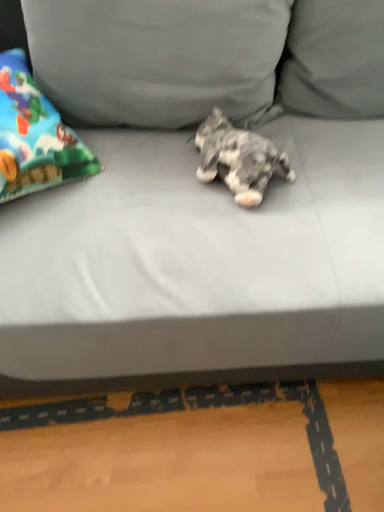
Question: Can you confirm if gray fabric pillow at upper center is wider than gray fabric couch at center?

Choices:
 (A) no
 (B) yes

Answer: (A)

Question: Is gray fabric pillow at upper center facing away from gray fabric couch at center?

Choices:
 (A) yes
 (B) no

Answer: (A)

Question: From the image's perspective, is gray fabric pillow at upper center beneath gray fabric couch at center?

Choices:
 (A) no
 (B) yes

Answer: (A)

Question: Is gray fabric pillow at upper center at the left side of gray fabric couch at center?

Choices:
 (A) no
 (B) yes

Answer: (B)

Question: Is gray fabric pillow at upper center next to gray fabric couch at center?

Choices:
 (A) no
 (B) yes

Answer: (A)

Question: Does point (210, 5) appear closer or farther from the camera than point (218, 138)?

Choices:
 (A) farther
 (B) closer

Answer: (B)

Question: Considering the positions of gray fabric pillow at upper center and fluffy gray dog at center in the image, is gray fabric pillow at upper center wider or thinner than fluffy gray dog at center?

Choices:
 (A) thin
 (B) wide

Answer: (B)

Question: Is gray fabric pillow at upper center taller or shorter than fluffy gray dog at center?

Choices:
 (A) short
 (B) tall

Answer: (B)

Question: Would you say gray fabric pillow at upper center is to the left or to the right of fluffy gray dog at center in the picture?

Choices:
 (A) right
 (B) left

Answer: (B)

Question: Which is correct: gray fabric couch at center is inside fluffy gray dog at center, or outside of it?

Choices:
 (A) outside
 (B) inside

Answer: (A)

Question: In terms of width, does gray fabric couch at center look wider or thinner when compared to fluffy gray dog at center?

Choices:
 (A) thin
 (B) wide

Answer: (B)

Question: From their relative heights in the image, would you say gray fabric couch at center is taller or shorter than fluffy gray dog at center?

Choices:
 (A) short
 (B) tall

Answer: (B)

Question: From the image's perspective, is gray fabric couch at center positioned above or below fluffy gray dog at center?

Choices:
 (A) above
 (B) below

Answer: (B)

Question: Considering the positions of fluffy gray dog at center and gray fabric couch at center in the image, is fluffy gray dog at center taller or shorter than gray fabric couch at center?

Choices:
 (A) short
 (B) tall

Answer: (A)

Question: In the image, is fluffy gray dog at center on the left side or the right side of gray fabric couch at center?

Choices:
 (A) right
 (B) left

Answer: (A)